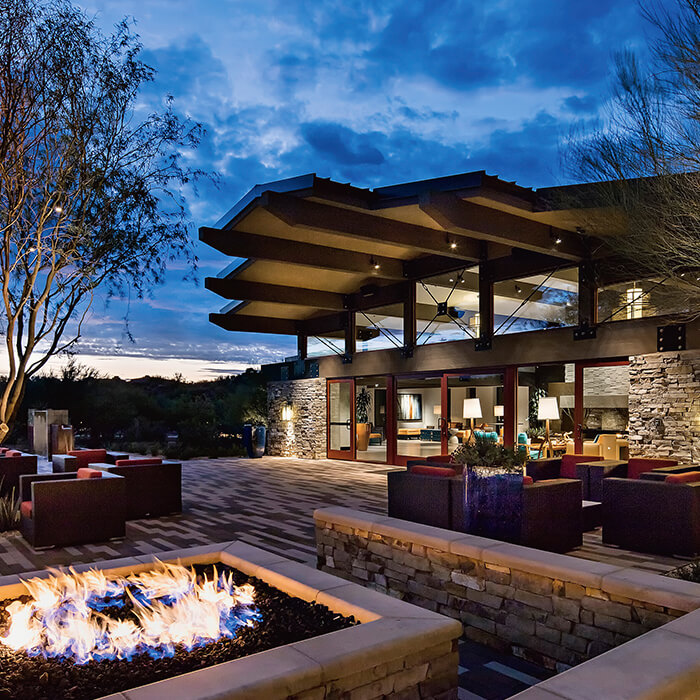
The width and height of the screenshot is (700, 700). What are the coordinates of `lamps` in the screenshot? It's located at (474, 406), (498, 411), (553, 412).